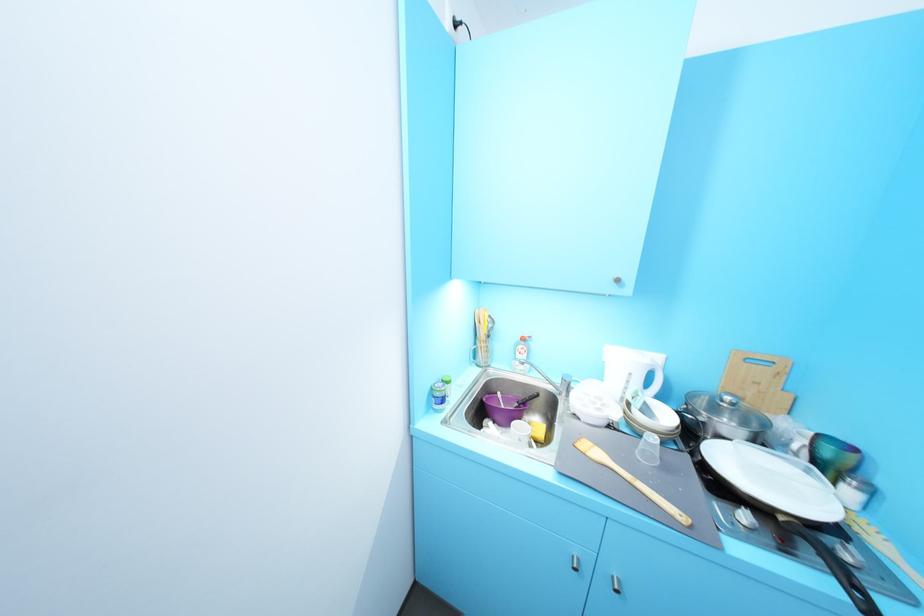
Where would you lift the wooden cutting board? Please return your answer as a coordinate pair (x, y).

(638, 477)